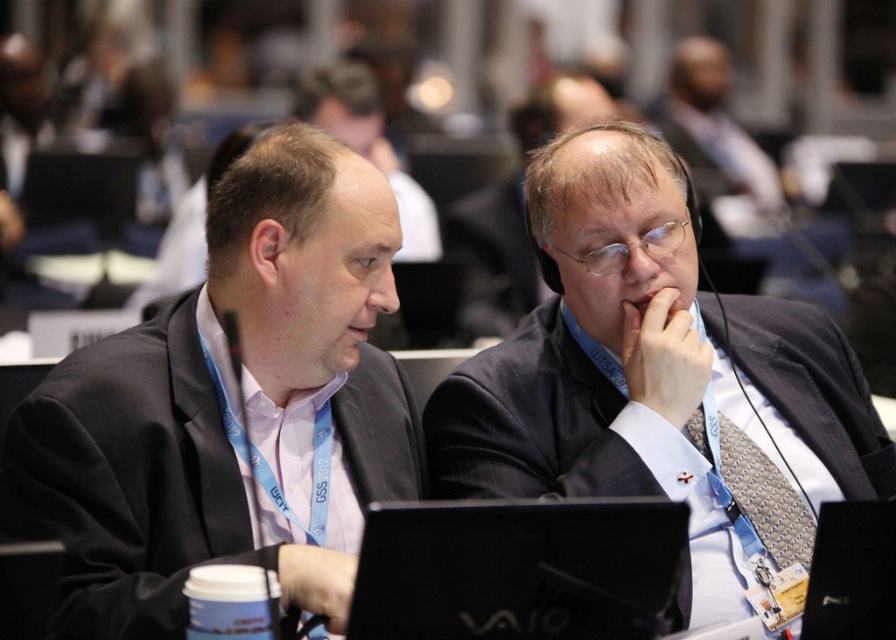
Question: Among these objects, which one is farthest from the camera?

Choices:
 (A) black matte laptop at center
 (B) matte black suit at center
 (C) black matte suit at center
 (D) silver textured tie at center

Answer: (B)

Question: Which object is positioned closest to the matte black suit at left?

Choices:
 (A) dark blue suit at center
 (B) black matte laptop at center
 (C) silver textured tie at center
 (D) black matte suit at center

Answer: (A)

Question: Can you confirm if black matte laptop at center is wider than matte black suit at center?

Choices:
 (A) no
 (B) yes

Answer: (A)

Question: Can you confirm if black matte suit at center is thinner than black matte laptop at center?

Choices:
 (A) yes
 (B) no

Answer: (B)

Question: Is black matte laptop at center below silver textured tie at center?

Choices:
 (A) yes
 (B) no

Answer: (A)

Question: Which object appears closest to the camera in this image?

Choices:
 (A) dark blue suit at center
 (B) silver textured tie at center
 (C) matte black suit at left
 (D) black matte laptop at center

Answer: (D)